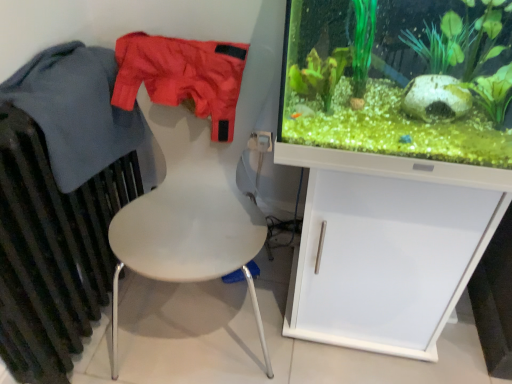
Question: Is white matte cabinet at right outside of dark gray metallic radiator at left?

Choices:
 (A) no
 (B) yes

Answer: (B)

Question: Is white matte cabinet at right far away from dark gray metallic radiator at left?

Choices:
 (A) no
 (B) yes

Answer: (A)

Question: Considering the relative sizes of white matte cabinet at right and dark gray metallic radiator at left in the image provided, is white matte cabinet at right thinner than dark gray metallic radiator at left?

Choices:
 (A) no
 (B) yes

Answer: (A)

Question: Is white matte cabinet at right oriented towards dark gray metallic radiator at left?

Choices:
 (A) yes
 (B) no

Answer: (B)

Question: Can you confirm if white matte cabinet at right is shorter than dark gray metallic radiator at left?

Choices:
 (A) no
 (B) yes

Answer: (B)

Question: From the image's perspective, is white matte cabinet at right below dark gray metallic radiator at left?

Choices:
 (A) no
 (B) yes

Answer: (B)

Question: Does dark gray metallic radiator at left have a lesser width compared to white matte cabinet at right?

Choices:
 (A) no
 (B) yes

Answer: (B)

Question: Does dark gray metallic radiator at left appear on the right side of white matte cabinet at right?

Choices:
 (A) yes
 (B) no

Answer: (B)

Question: From the image's perspective, is dark gray metallic radiator at left on top of white matte cabinet at right?

Choices:
 (A) yes
 (B) no

Answer: (A)

Question: Is dark gray metallic radiator at left facing away from white matte cabinet at right?

Choices:
 (A) no
 (B) yes

Answer: (A)

Question: Is the position of dark gray metallic radiator at left less distant than that of white matte cabinet at right?

Choices:
 (A) no
 (B) yes

Answer: (B)

Question: From a real-world perspective, does dark gray metallic radiator at left sit lower than white matte cabinet at right?

Choices:
 (A) no
 (B) yes

Answer: (A)

Question: Considering the relative positions of green matte plant at right and matte nylon shorts at upper left, the second clothing in the left-to-right sequence, in the image provided, is green matte plant at right to the right of matte nylon shorts at upper left, the second clothing in the left-to-right sequence, from the viewer's perspective?

Choices:
 (A) no
 (B) yes

Answer: (B)